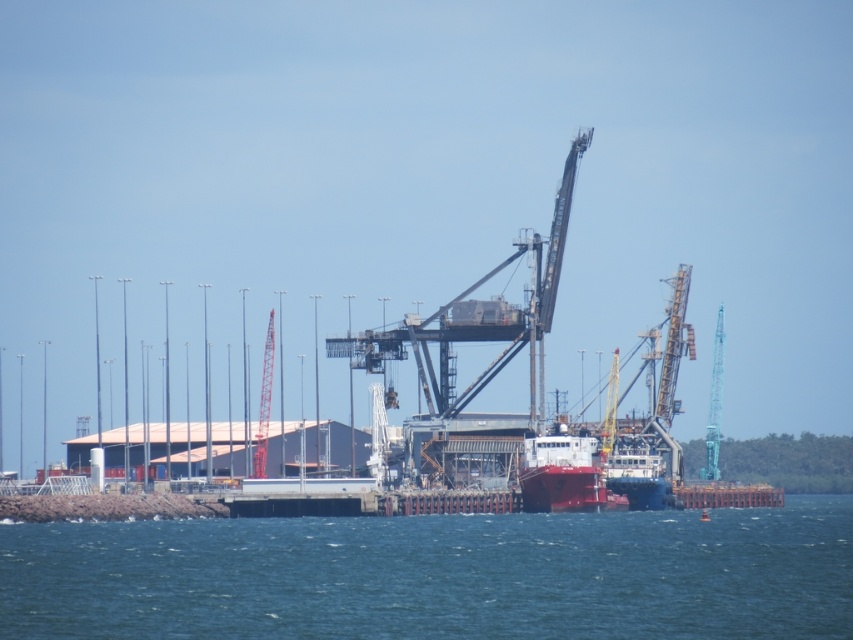
Question: From the image, what is the correct spatial relationship of blue water at lower center in relation to smooth red ship at center?

Choices:
 (A) right
 (B) left

Answer: (B)

Question: Which point is farther to the camera?

Choices:
 (A) smooth red ship at center
 (B) blue water at lower center

Answer: (A)

Question: Does blue water at lower center lie in front of smooth red ship at center?

Choices:
 (A) no
 (B) yes

Answer: (B)

Question: Does blue water at lower center appear over smooth red ship at center?

Choices:
 (A) no
 (B) yes

Answer: (A)